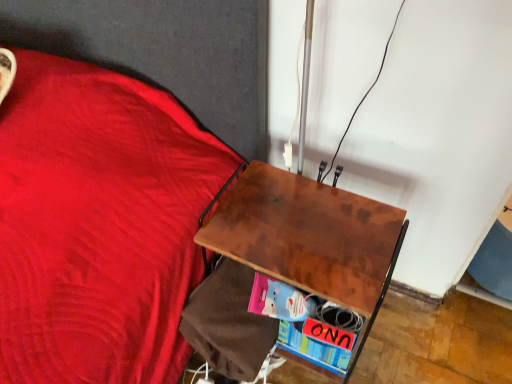
What is the approximate width of multicolored cardboard book at lower right?

It is 7.56 centimeters.

Describe the element at coordinates (313, 349) in the screenshot. The height and width of the screenshot is (384, 512). I see `multicolored cardboard book at lower right` at that location.

You are a GUI agent. You are given a task and a screenshot of the screen. Output one action in this format:
    pyautogui.click(x=<x>, y=<y>)
    Task: Click on the multicolored cardboard book at lower right
    This screenshot has height=384, width=512.
    Given the screenshot: What is the action you would take?
    pyautogui.click(x=313, y=349)

Locate an element on the screen. This screenshot has width=512, height=384. brown wood desk at center is located at coordinates (310, 238).

What do you see at coordinates (310, 238) in the screenshot?
I see `brown wood desk at center` at bounding box center [310, 238].

Locate an element on the screen. multicolored cardboard book at lower right is located at coordinates (313, 349).

Which is more to the right, multicolored cardboard book at lower right or brown wood desk at center?

multicolored cardboard book at lower right is more to the right.

Between multicolored cardboard book at lower right and brown wood desk at center, which one is positioned behind?

multicolored cardboard book at lower right is more distant.

Is point (284, 322) positioned behind point (302, 278)?

Yes.

From the image's perspective, who appears lower, multicolored cardboard book at lower right or brown wood desk at center?

multicolored cardboard book at lower right, from the image's perspective.

From a real-world perspective, is multicolored cardboard book at lower right positioned above or below brown wood desk at center?

Clearly, from a real-world perspective, multicolored cardboard book at lower right is below brown wood desk at center.

Does multicolored cardboard book at lower right have a lesser width compared to brown wood desk at center?

Yes.

Is multicolored cardboard book at lower right taller than brown wood desk at center?

No.

Can you confirm if multicolored cardboard book at lower right is smaller than brown wood desk at center?

Yes, multicolored cardboard book at lower right is smaller than brown wood desk at center.

Can we say multicolored cardboard book at lower right lies outside brown wood desk at center?

No, multicolored cardboard book at lower right is inside brown wood desk at center's boundary.

Are multicolored cardboard book at lower right and brown wood desk at center beside each other?

No.

Is multicolored cardboard book at lower right oriented towards brown wood desk at center?

Yes, multicolored cardboard book at lower right is turned towards brown wood desk at center.

How different are the orientations of multicolored cardboard book at lower right and brown wood desk at center in degrees?

0.138 degrees.

You are a GUI agent. You are given a task and a screenshot of the screen. Output one action in this format:
    pyautogui.click(x=<x>, y=<y>)
    Task: Click on the paperback book behind the brown wood desk at center
    Image resolution: width=512 pixels, height=384 pixels.
    Given the screenshot: What is the action you would take?
    pyautogui.click(x=313, y=349)

Is brown wood desk at center to the left or to the right of multicolored cardboard book at lower right in the image?

From the image, it's evident that brown wood desk at center is to the left of multicolored cardboard book at lower right.

Considering their positions, is brown wood desk at center located in front of or behind multicolored cardboard book at lower right?

In the image, brown wood desk at center appears in front of multicolored cardboard book at lower right.

Is point (320, 289) closer or farther from the camera than point (338, 374)?

Point (320, 289) is closer to the camera than point (338, 374).

From the image's perspective, which one is positioned higher, brown wood desk at center or multicolored cardboard book at lower right?

From the image's view, brown wood desk at center is above.

From a real-world perspective, is brown wood desk at center above or below multicolored cardboard book at lower right?

brown wood desk at center is above multicolored cardboard book at lower right.

Considering the sizes of brown wood desk at center and multicolored cardboard book at lower right in the image, is brown wood desk at center wider or thinner than multicolored cardboard book at lower right?

Clearly, brown wood desk at center has more width compared to multicolored cardboard book at lower right.

Does brown wood desk at center have a greater height compared to multicolored cardboard book at lower right?

Correct, brown wood desk at center is much taller as multicolored cardboard book at lower right.

Considering the sizes of brown wood desk at center and multicolored cardboard book at lower right in the image, is brown wood desk at center bigger or smaller than multicolored cardboard book at lower right?

Considering their sizes, brown wood desk at center takes up more space than multicolored cardboard book at lower right.

Is brown wood desk at center inside or outside of multicolored cardboard book at lower right?

brown wood desk at center is not enclosed by multicolored cardboard book at lower right.

Is brown wood desk at center far from multicolored cardboard book at lower right?

No, there isn't a large distance between brown wood desk at center and multicolored cardboard book at lower right.

Is brown wood desk at center oriented away from multicolored cardboard book at lower right?

Yes, multicolored cardboard book at lower right is at the back of brown wood desk at center.

How many degrees apart are the facing directions of brown wood desk at center and multicolored cardboard book at lower right?

They differ by 0.138 degrees in their facing directions.

Find the location of a particular element. The image size is (512, 384). desk located on the left of multicolored cardboard book at lower right is located at coordinates (310, 238).

The height and width of the screenshot is (384, 512). Find the location of `desk located in front of the multicolored cardboard book at lower right`. desk located in front of the multicolored cardboard book at lower right is located at coordinates (310, 238).

Find the location of a particular element. Image resolution: width=512 pixels, height=384 pixels. paperback book below the brown wood desk at center (from a real-world perspective) is located at coordinates (313, 349).